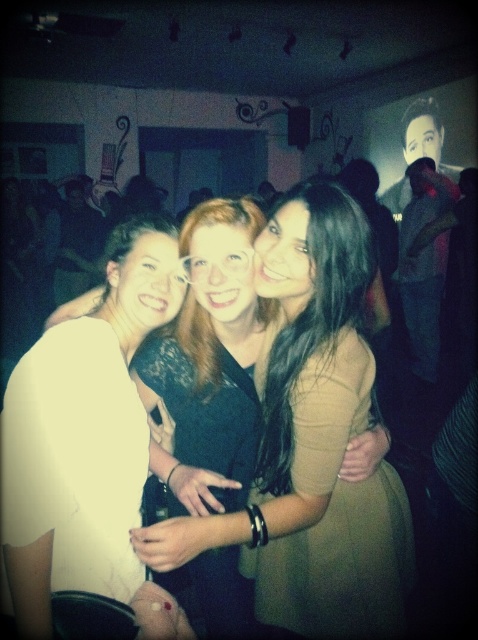
You are a photographer at the event and want to ensure both the white matte shirt at center and the matte black dress at center are clearly visible in the photo. Since the lighting is dim, which object might be harder to capture clearly and why?

The matte black dress at center might be harder to capture clearly because it is positioned under the white matte shirt at center, potentially causing it to be in shadow or less illuminated under the dim lighting.

You are at a party and want to take a photo of the point at coordinates (19, 582). Your camera has a focal length of 35mm and you are currently 35.65 inches away from the point. Is the point within the camera frame? Please explain.

The point at coordinates (19, 582) is exactly 35.65 inches away from the camera. Since the camera is positioned to capture the scene at this distance, the point should be within the camera frame as it is the focal point of the image.